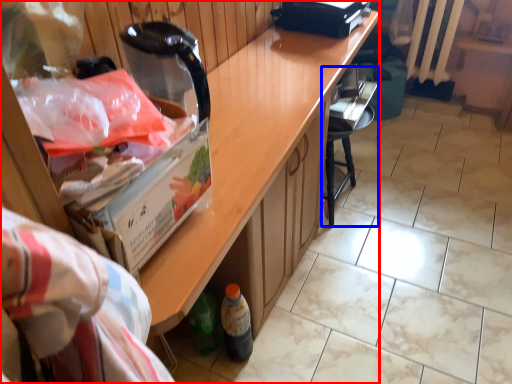
Question: Which object is closer to the camera taking this photo, cabinetry (highlighted by a red box) or chair (highlighted by a blue box)?

Choices:
 (A) cabinetry
 (B) chair

Answer: (A)